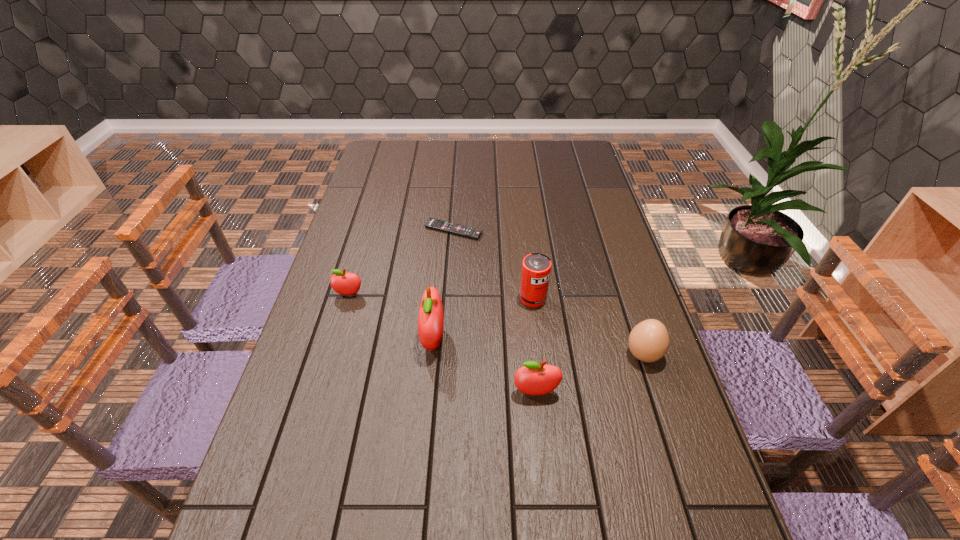
Please point a vacant point for placing a apple on the right. Please provide its 2D coordinates. Your answer should be formatted as a tuple, i.e. [(x, y)], where the tuple contains the x and y coordinates of a point satisfying the conditions above.

[(664, 460)]